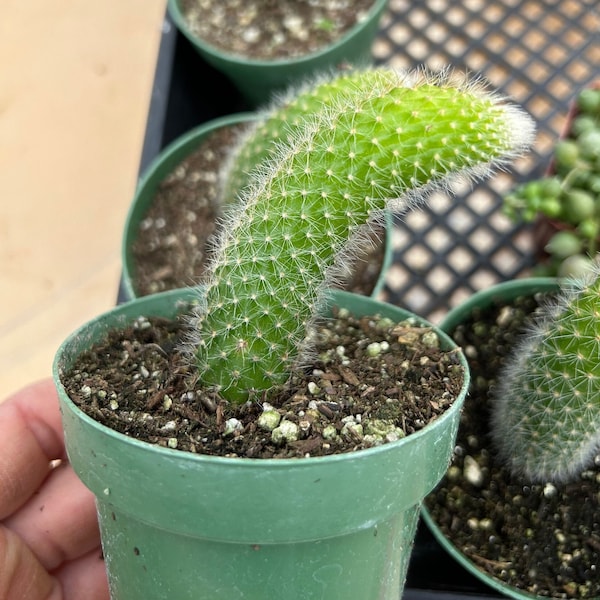
I want to click on pot, so click(x=475, y=573).